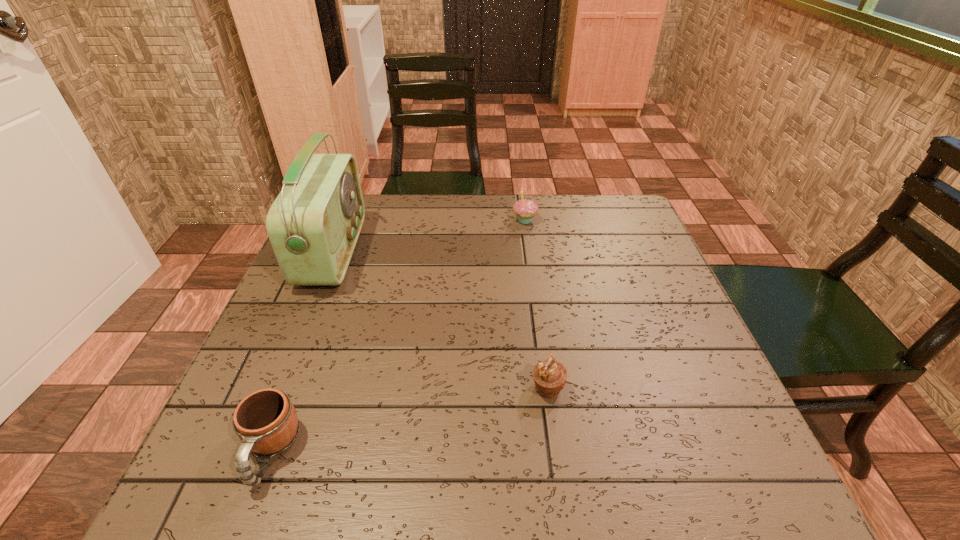
What are the coordinates of `the second closest object to the muffin` in the screenshot? It's located at (313, 225).

The height and width of the screenshot is (540, 960). In order to click on free space that satisfies the following two spatial constraints: 1. on the front panel of the tallest object; 2. on the left side of the muffin in this screenshot , I will do `click(277, 389)`.

In order to click on free space that satisfies the following two spatial constraints: 1. on the front side of the cupcake; 2. on the front panel of the tallest object in this screenshot , I will do `click(529, 252)`.